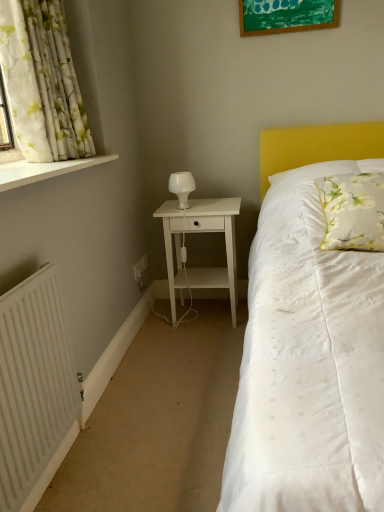
This screenshot has width=384, height=512. In order to click on vacant area on the back side of white ribbed radiator at lower left in this screenshot , I will do `click(122, 415)`.